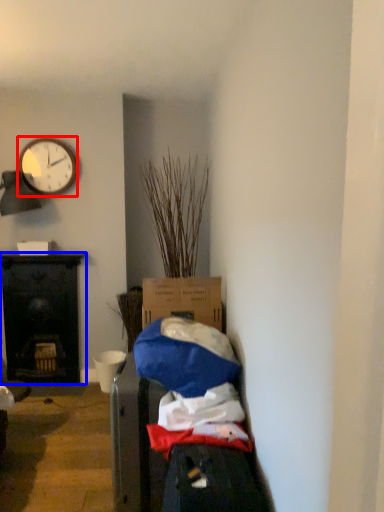
Question: Which of the following is the closest to the observer, clock (highlighted by a red box) or desk (highlighted by a blue box)?

Choices:
 (A) clock
 (B) desk

Answer: (A)